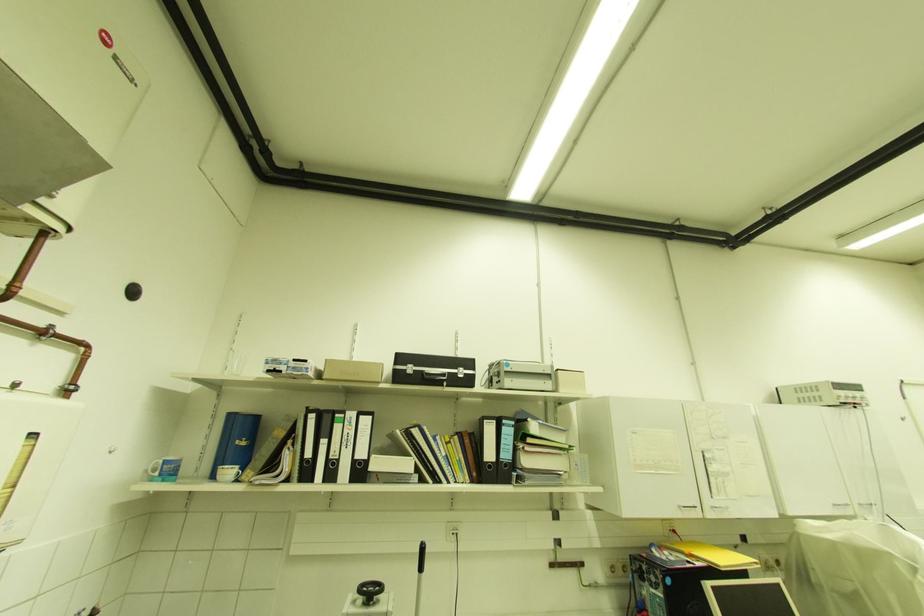
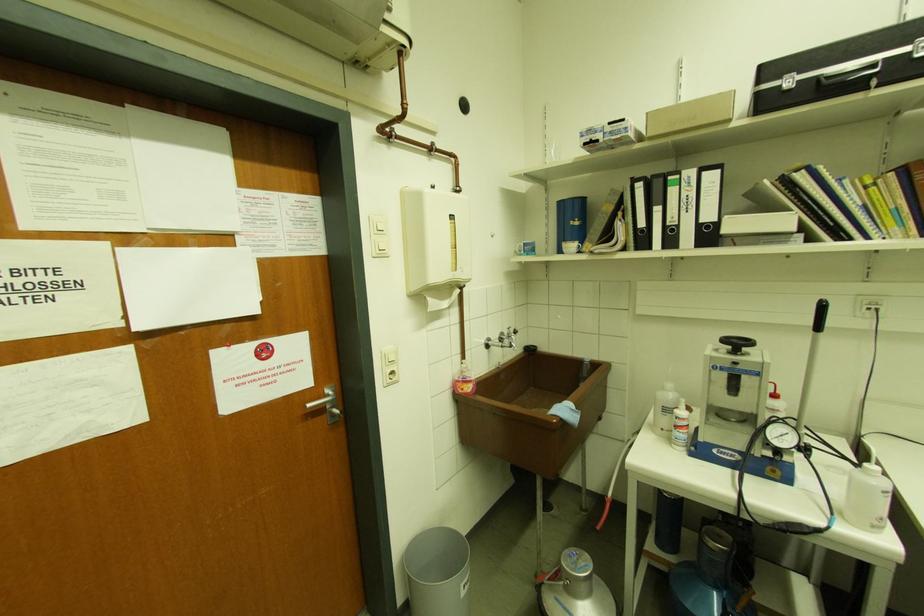
Find the pixel in the second image that matches the point at 233,472 in the first image.

(575, 246)